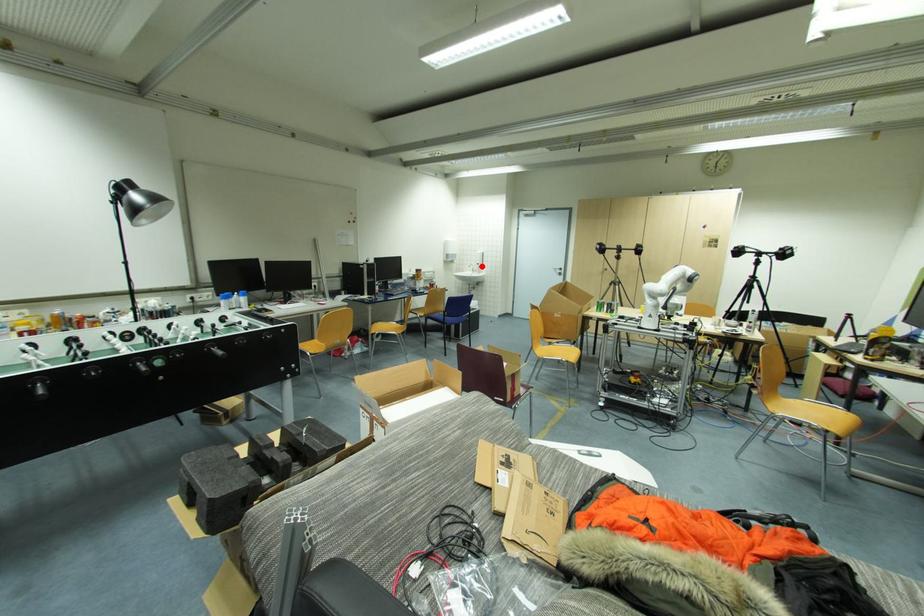
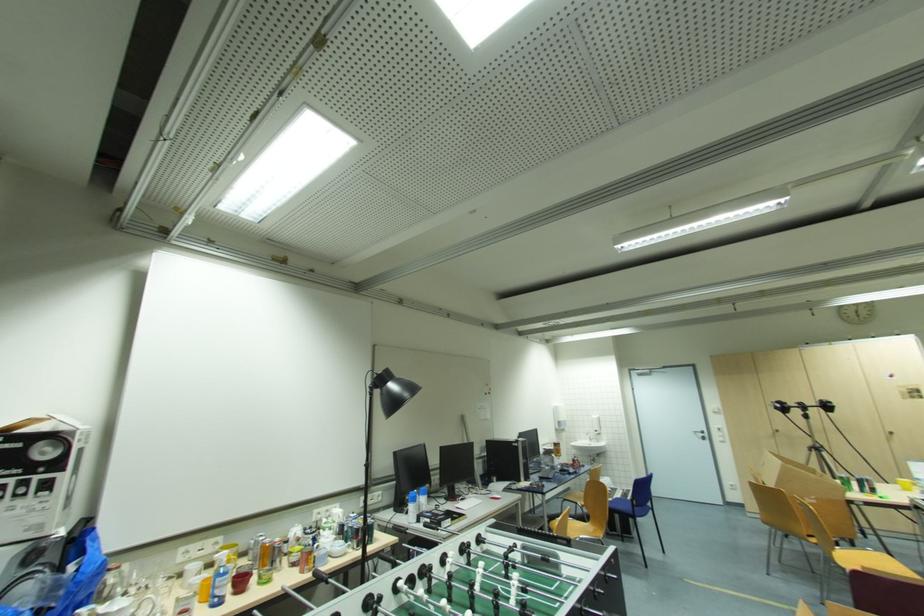
Question: I am providing you with two images of the same scene from different viewpoints. Image1 has a red point marked. In image2, the corresponding 3D location appears at what relative position? Reply with the corresponding letter.

Choices:
 (A) Closer
 (B) Farther

Answer: (B)